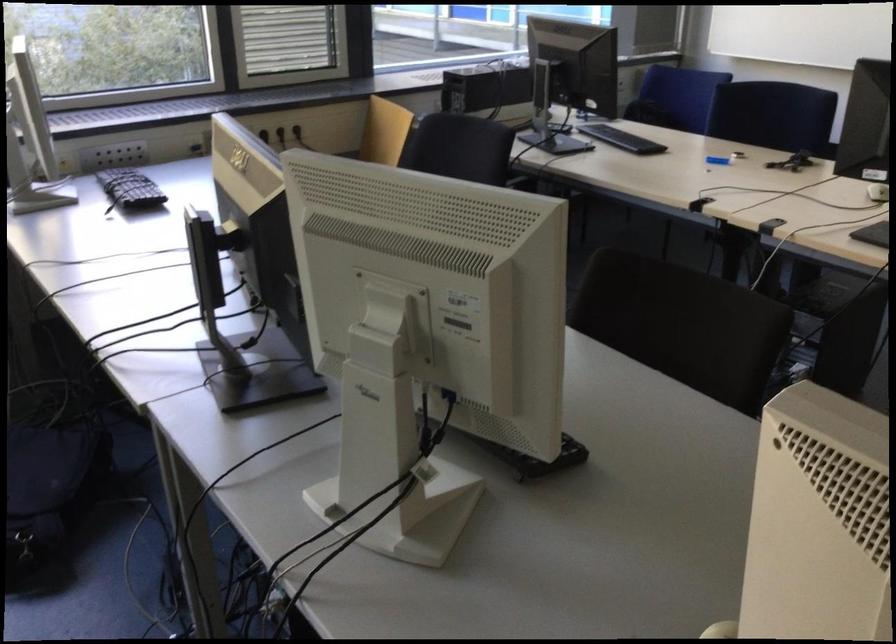
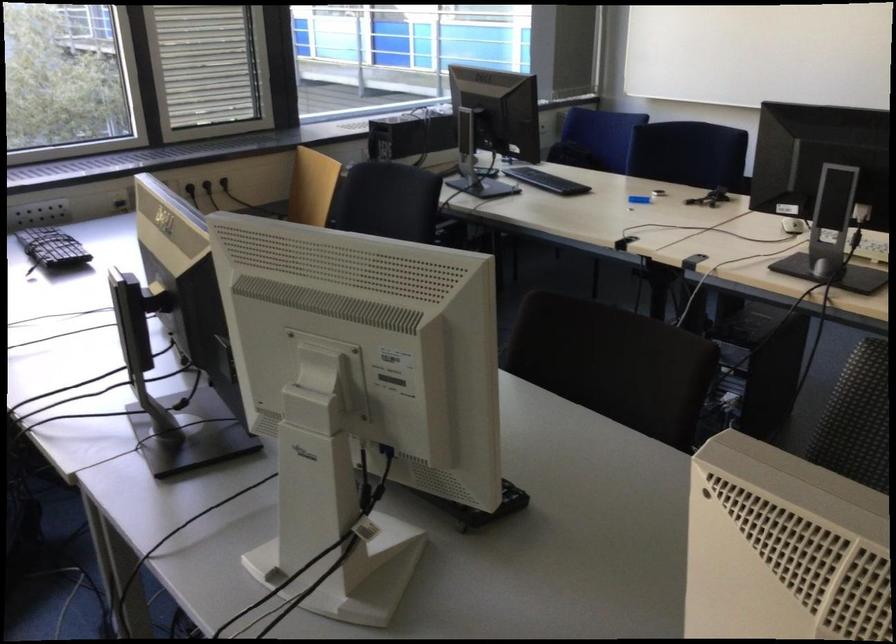
Question: The camera is either moving clockwise (left) or counter-clockwise (right) around the object. The first image is from the beginning of the video and the second image is from the end. Is the camera moving left or right when shooting the video?

Choices:
 (A) Left
 (B) Right

Answer: (A)